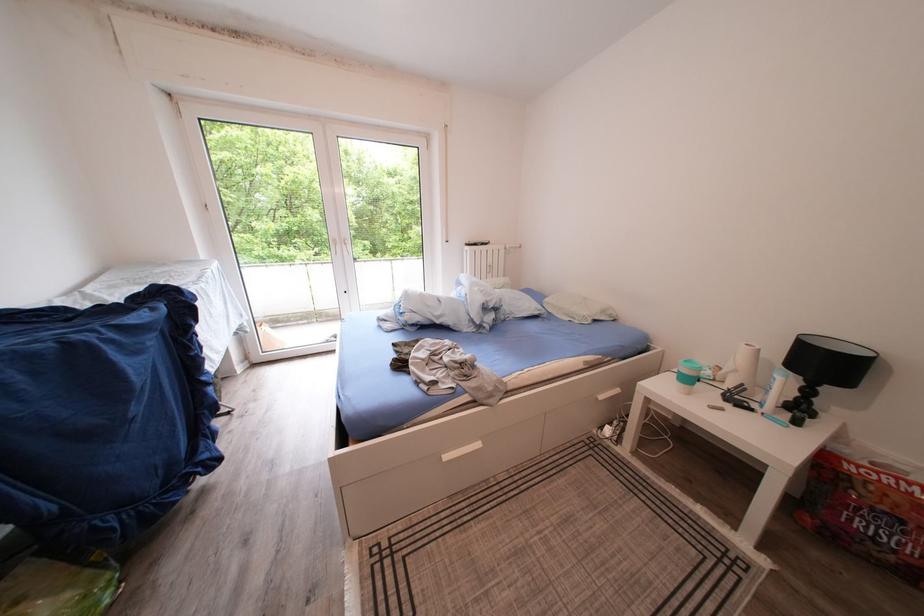
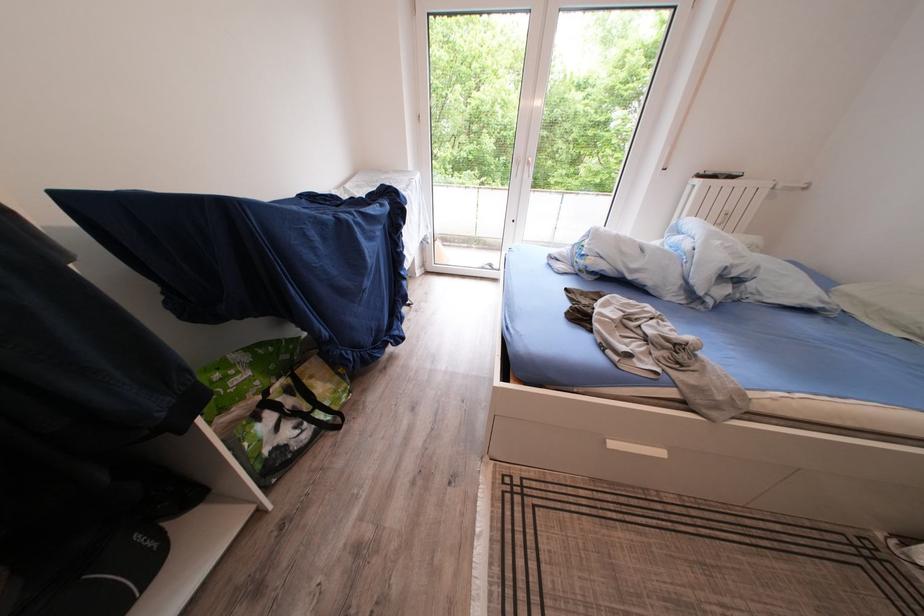
The images are taken continuously from a first-person perspective. In which direction is your viewpoint rotating?

The camera's rotation is toward left-down.